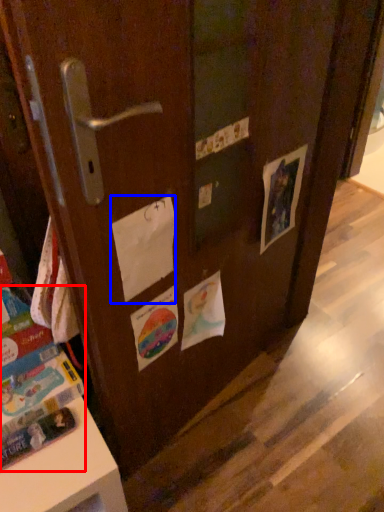
Question: Which object appears closest to the camera in this image, book (highlighted by a red box) or paper (highlighted by a blue box)?

Choices:
 (A) book
 (B) paper

Answer: (B)